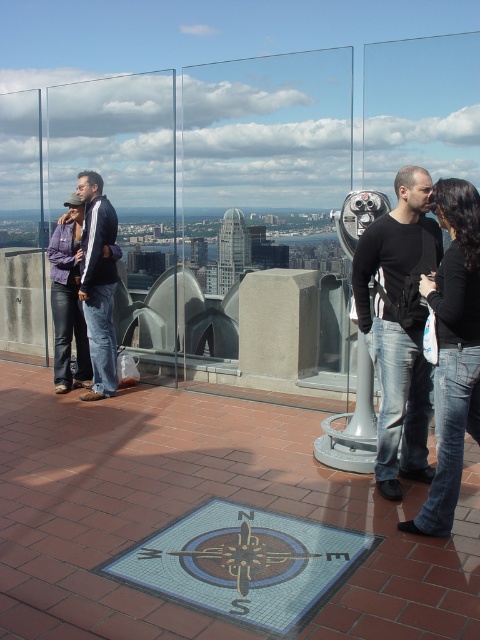
Question: Which is nearer to the matte black jacket at left?

Choices:
 (A) black matte shirt at center
 (B) black matte jeans at right

Answer: (A)

Question: Is black matte shirt at center thinner than matte black jacket at left?

Choices:
 (A) yes
 (B) no

Answer: (B)

Question: Which point appears farthest from the camera in this image?

Choices:
 (A) pyautogui.click(x=462, y=397)
 (B) pyautogui.click(x=429, y=392)

Answer: (B)

Question: In this image, where is black matte shirt at center located relative to black matte jeans at right?

Choices:
 (A) left
 (B) right

Answer: (A)

Question: Estimate the real-world distances between objects in this image. Which object is closer to the black matte jeans at right?

Choices:
 (A) matte black jacket at left
 (B) black matte shirt at center

Answer: (B)

Question: Is black matte shirt at center positioned behind black matte jeans at right?

Choices:
 (A) no
 (B) yes

Answer: (B)